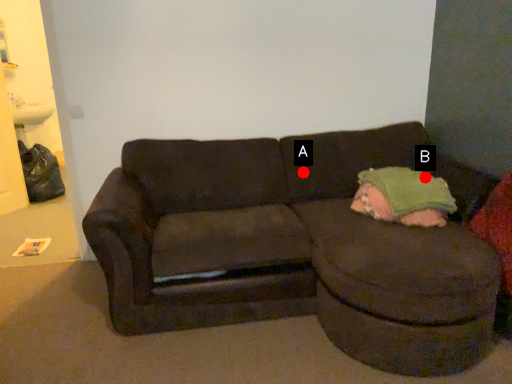
Question: Two points are circled on the image, labeled by A and B beside each circle. Which point is closer to the camera?

Choices:
 (A) A is closer
 (B) B is closer

Answer: (B)